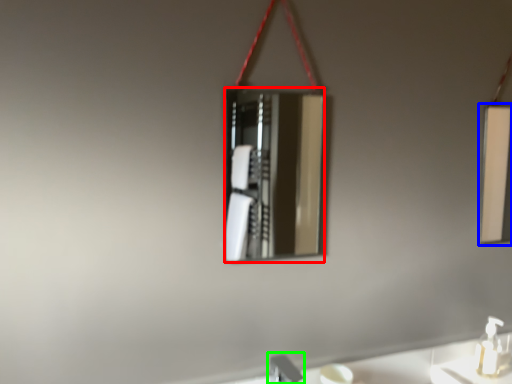
Question: Which is farther away from mirror (highlighted by a red box)? mirror (highlighted by a blue box) or faucet (highlighted by a green box)?

Choices:
 (A) mirror
 (B) faucet

Answer: (B)